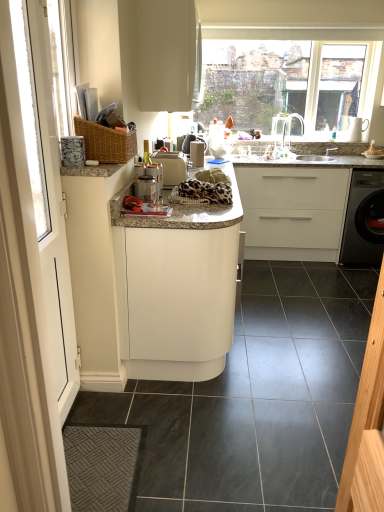
Identify the location of white matte cabinet at upper center, the 1th cabinetry from the top. This screenshot has height=512, width=384. coord(167,53).

What is the approximate width of metallic silver toaster at center, which ranks as the first appliance in top-to-bottom order?

5.41 inches.

I want to click on beige plastic toaster at center, which is the 1th appliance from left to right, so [171, 167].

Where is `clear glass window at upper right`? clear glass window at upper right is located at coordinates (289, 74).

This screenshot has height=512, width=384. What do you see at coordinates (204, 189) in the screenshot?
I see `leopard print fabric at center` at bounding box center [204, 189].

You are a GUI agent. You are given a task and a screenshot of the screen. Output one action in this format:
    pyautogui.click(x=<x>, y=<y>)
    Task: Click on the white matte cabinet at center, marked as the 3th cabinetry in a top-to-bottom arrangement
    This screenshot has height=512, width=384.
    Given the screenshot: What is the action you would take?
    pyautogui.click(x=176, y=288)

This screenshot has width=384, height=512. Find the location of `white matte cabinet at upper center, the 1th cabinetry from the top`. white matte cabinet at upper center, the 1th cabinetry from the top is located at coordinates (167, 53).

How far apart are beige plastic toaster at center, the first appliance in the bottom-to-top sequence, and satin silver coffee machine at center?

beige plastic toaster at center, the first appliance in the bottom-to-top sequence, is 4.35 inches from satin silver coffee machine at center.

In the image, is beige plastic toaster at center, which is the 1th appliance from left to right, positioned in front of or behind satin silver coffee machine at center?

beige plastic toaster at center, which is the 1th appliance from left to right, is positioned farther from the viewer than satin silver coffee machine at center.

In the image, is beige plastic toaster at center, the second appliance when ordered from top to bottom, on the left side or the right side of satin silver coffee machine at center?

In the image, beige plastic toaster at center, the second appliance when ordered from top to bottom, appears on the right side of satin silver coffee machine at center.

Which appliance is the 1st one when counting from the right side of the satin silver coffee machine at center? Please provide its 2D coordinates.

[(171, 167)]

From a real-world perspective, which object stands above the other?

From a 3D spatial view, woven wood basket at upper left is above.

Is point (15, 162) closer or farther from the camera than point (84, 120)?

Point (15, 162) appears to be closer to the viewer than point (84, 120).

Could you tell me if white glossy screen door at left is turned towards woven wood basket at upper left?

No, white glossy screen door at left is not oriented towards woven wood basket at upper left.

Image resolution: width=384 pixels, height=512 pixels. In order to click on the 2nd appliance behind the white matte cabinet at upper center, the 1th cabinetry from the top in this screenshot , I will do `click(197, 153)`.

From the picture: Can you confirm if white matte cabinet at upper center, the 1th cabinetry from the top, is positioned to the left of metallic silver toaster at center, positioned as the 2th appliance in left-to-right order?

Yes, white matte cabinet at upper center, the 1th cabinetry from the top, is to the left of metallic silver toaster at center, positioned as the 2th appliance in left-to-right order.

Considering the positions of point (159, 32) and point (195, 140), is point (159, 32) closer or farther from the camera than point (195, 140)?

Point (159, 32) is positioned closer to the camera compared to point (195, 140).

In terms of width, does clear glass window at upper right look wider or thinner when compared to leopard print fabric at center?

Clearly, clear glass window at upper right has less width compared to leopard print fabric at center.

Are clear glass window at upper right and leopard print fabric at center located far from each other?

Yes, clear glass window at upper right and leopard print fabric at center are located far from each other.

Looking at this image, what's the angular difference between clear glass window at upper right and leopard print fabric at center's facing directions?

There is a 89.9-degree angle between the facing directions of clear glass window at upper right and leopard print fabric at center.

Does clear glass window at upper right have a greater height compared to leopard print fabric at center?

Yes.

Can you confirm if leopard print fabric at center is positioned to the right of granite countertop at center?

In fact, leopard print fabric at center is to the left of granite countertop at center.

Looking at this image, which point is more distant from viewer, (230,197) or (357,163)?

The point (357,163) is farther from the camera.

How different are the orientations of leopard print fabric at center and granite countertop at center in degrees?

0.303 degrees.

Between point (141, 331) and point (250, 40), which one is positioned behind?

The point (250, 40) is behind.

Is white matte cabinet at center, marked as the 3th cabinetry in a top-to-bottom arrangement, aimed at clear glass window at upper right?

No, white matte cabinet at center, marked as the 3th cabinetry in a top-to-bottom arrangement, is not turned towards clear glass window at upper right.

This screenshot has height=512, width=384. Identify the location of window that is behind the white matte cabinet at center, the 1th cabinetry ordered from the bottom. (289, 74).

How distant is white matte cabinet at center, the 1th cabinetry ordered from the bottom, from clear glass window at upper right?

white matte cabinet at center, the 1th cabinetry ordered from the bottom, is 2.52 meters away from clear glass window at upper right.

Is beige plastic toaster at center, the first appliance in the bottom-to-top sequence, inside or outside of white glossy screen door at left?

beige plastic toaster at center, the first appliance in the bottom-to-top sequence, is outside white glossy screen door at left.

From a real-world perspective, relative to white glossy screen door at left, is beige plastic toaster at center, which is counted as the second appliance, starting from the right, vertically above or below?

From a real-world perspective, beige plastic toaster at center, which is counted as the second appliance, starting from the right, is physically above white glossy screen door at left.

From the image's perspective, is beige plastic toaster at center, the first appliance from the front, located above or below white glossy screen door at left?

From the image's perspective, beige plastic toaster at center, the first appliance from the front, appears above white glossy screen door at left.

Consider the image. Considering the sizes of beige plastic toaster at center, the first appliance from the front, and white glossy screen door at left in the image, is beige plastic toaster at center, the first appliance from the front, bigger or smaller than white glossy screen door at left?

beige plastic toaster at center, the first appliance from the front, is smaller than white glossy screen door at left.

At what (x,y) coordinates should I click in order to perform the action: click on the 1st appliance behind the satin silver coffee machine at center. Please return your answer as a coordinate pair (x, y). The height and width of the screenshot is (512, 384). Looking at the image, I should click on (171, 167).

This screenshot has height=512, width=384. Identify the location of screen door that appears below the woven wood basket at upper left (from a real-world perspective). (32, 288).

Considering their positions, is leopard print fabric at center positioned closer to white matte cabinet at upper center, the third cabinetry ordered from the bottom, than black glossy washing machine at right?

leopard print fabric at center is closer to white matte cabinet at upper center, the third cabinetry ordered from the bottom.

When comparing their distances from metallic silver toaster at center, which ranks as the first appliance in top-to-bottom order, does white glossy screen door at left or white matte cabinet at center, marked as the 3th cabinetry in a top-to-bottom arrangement, seem closer?

The object closer to metallic silver toaster at center, which ranks as the first appliance in top-to-bottom order, is white matte cabinet at center, marked as the 3th cabinetry in a top-to-bottom arrangement.

From the image, which object appears to be nearer to beige plastic toaster at center, the first appliance in the bottom-to-top sequence, leopard print fabric at center or white matte cabinet at upper center, the 1th cabinetry from the top?

leopard print fabric at center is closer to beige plastic toaster at center, the first appliance in the bottom-to-top sequence.

Looking at the image, which one is located closer to woven wood basket at upper left, metallic silver toaster at center, positioned as the 2th appliance in left-to-right order, or black glossy washing machine at right?

The object closer to woven wood basket at upper left is metallic silver toaster at center, positioned as the 2th appliance in left-to-right order.

When comparing their distances from clear glass window at upper right, does metallic silver toaster at center, placed as the 1th appliance when sorted from back to front, or white matte cabinet at upper center, the third cabinetry ordered from the bottom, seem closer?

Among the two, metallic silver toaster at center, placed as the 1th appliance when sorted from back to front, is located nearer to clear glass window at upper right.

Estimate the real-world distances between objects in this image. Which object is closer to satin silver coffee machine at center, metallic silver toaster at center, which ranks as the second appliance in front-to-back order, or white matte cabinet at center, marked as the 3th cabinetry in a top-to-bottom arrangement?

white matte cabinet at center, marked as the 3th cabinetry in a top-to-bottom arrangement, is positioned closer to the anchor satin silver coffee machine at center.

Considering their positions, is clear glass window at upper right positioned further to leopard print fabric at center than beige plastic toaster at center, which is the 1th appliance from left to right?

Among the two, clear glass window at upper right is located further to leopard print fabric at center.

Estimate the real-world distances between objects in this image. Which object is closer to beige plastic toaster at center, which is counted as the second appliance, starting from the right, white glossy screen door at left or satin silver coffee machine at center?

Among the two, satin silver coffee machine at center is located nearer to beige plastic toaster at center, which is counted as the second appliance, starting from the right.

Identify the location of material positioned between woven wood basket at upper left and white matte cabinet at center, positioned as the 2th cabinetry in bottom-to-top order, from near to far. (204, 189).

Locate an element on the screen. basket located between white glossy screen door at left and white matte cabinet at center, the 1th cabinetry ordered from the bottom, in the depth direction is located at coordinates (106, 142).

Where is `appliance between satin silver coffee machine at center and metallic silver toaster at center, positioned as the 2th appliance in left-to-right order, along the z-axis`? Image resolution: width=384 pixels, height=512 pixels. appliance between satin silver coffee machine at center and metallic silver toaster at center, positioned as the 2th appliance in left-to-right order, along the z-axis is located at coordinates (171, 167).

I want to click on coffee machine between woven wood basket at upper left and metallic silver toaster at center, the second appliance ordered from the bottom, from front to back, so click(x=149, y=176).